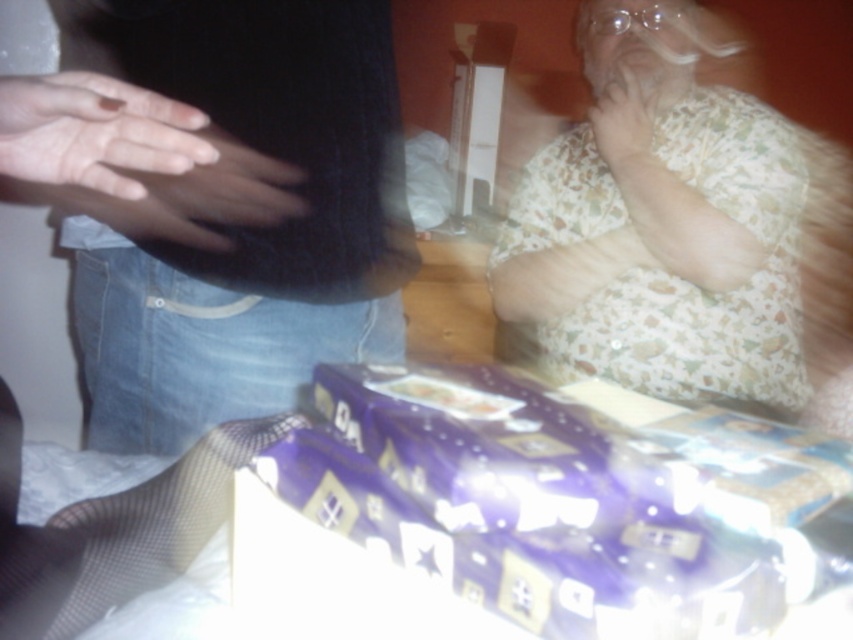
You are organizing a gift table and need to ensure that the floral cotton shirt at upper right and the matte black hand at left are visible in the photo. Based on their positions, which object is positioned higher up in the image?

The floral cotton shirt at upper right is taller than the matte black hand at left, so it is positioned higher up in the image.

You are a photographer trying to capture a closeup shot of the wrapped gifts in the foreground. You notice two matte skin hands in the frame. How far apart are the matte skin hand at left and the matte skin hand at upper right?

The distance between the matte skin hand at left and the matte skin hand at upper right is 3.28 feet.

You are at a party and see the matte skin hand at left reaching towards the wrapped gifts. If you want to place a small gift in the hand, will it fit?

The matte skin hand at left is 39.95 centimeters away from the viewer, so the small gift can be placed in the hand as the distance allows for easy reach.